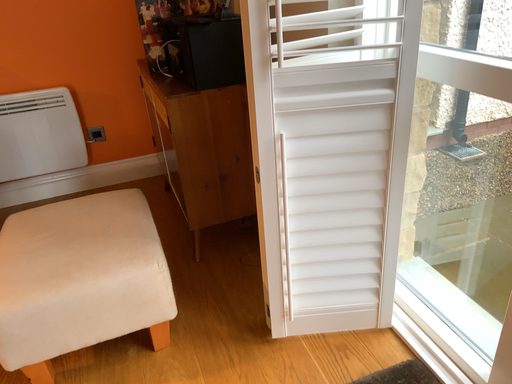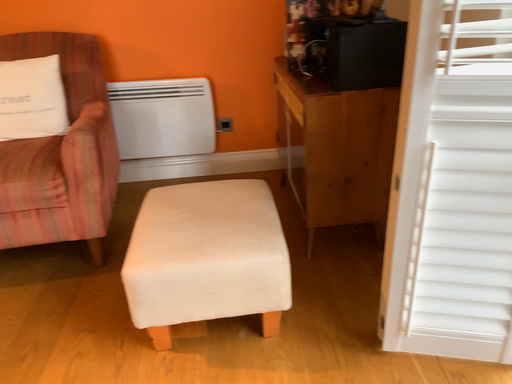
Question: How did the camera likely rotate when shooting the video?

Choices:
 (A) rotated right
 (B) rotated left

Answer: (B)